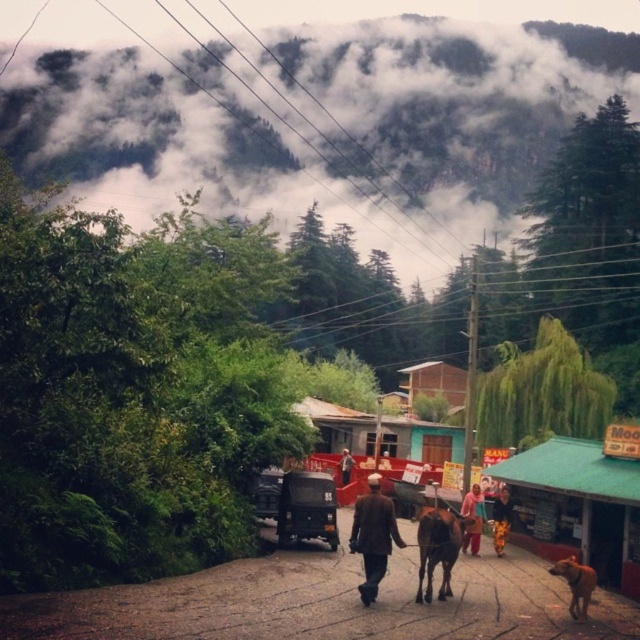
Question: Among these points, which one is farthest from the camera?

Choices:
 (A) (502, 497)
 (B) (465, 513)
 (C) (326, 483)

Answer: (A)

Question: Does metallic dark green truck at center appear under bright pink fabric at center?

Choices:
 (A) yes
 (B) no

Answer: (B)

Question: Which of the following is the farthest from the observer?

Choices:
 (A) [x=369, y=486]
 (B) [x=554, y=28]

Answer: (B)

Question: In this image, where is metallic dark green truck at center located relative to dark brown woolen coat at center?

Choices:
 (A) above
 (B) below

Answer: (A)

Question: Can you confirm if foggy misty mountain at upper center is wider than metallic dark green truck at center?

Choices:
 (A) yes
 (B) no

Answer: (A)

Question: Which of these objects is positioned closest to the yellow fabric pants at lower right?

Choices:
 (A) metallic dark green truck at center
 (B) foggy misty mountain at upper center
 (C) bright pink fabric at center

Answer: (C)